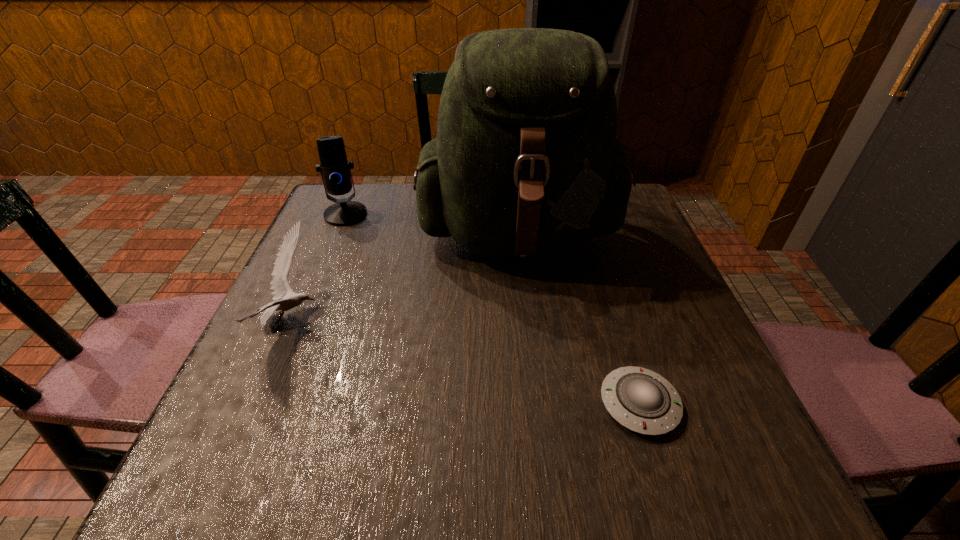
The image size is (960, 540). I want to click on backpack, so click(x=526, y=161).

Locate an element on the screen. The width and height of the screenshot is (960, 540). the second tallest object is located at coordinates (334, 168).

Find the location of a particular element. Image resolution: width=960 pixels, height=540 pixels. the second shortest object is located at coordinates (280, 287).

Identify the location of the shortest object. This screenshot has height=540, width=960. click(x=641, y=400).

Where is `vacant space located 0.390m on the open flap of the tallest object`? This screenshot has height=540, width=960. vacant space located 0.390m on the open flap of the tallest object is located at coordinates (547, 472).

This screenshot has height=540, width=960. What are the coordinates of `free location located 0.050m on the stand of the third shortest object` in the screenshot? It's located at (336, 238).

Where is `vacant space located at the tip of the beak of the second shortest object`? vacant space located at the tip of the beak of the second shortest object is located at coordinates (523, 320).

Where is `vacant point located 0.280m on the left of the shortest object`? The width and height of the screenshot is (960, 540). vacant point located 0.280m on the left of the shortest object is located at coordinates (431, 404).

Where is `backpack positioned at the far edge`? backpack positioned at the far edge is located at coordinates (526, 161).

Image resolution: width=960 pixels, height=540 pixels. What are the coordinates of `microphone at the far edge` in the screenshot? It's located at (334, 168).